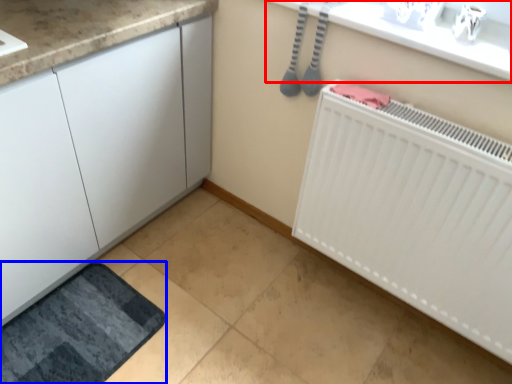
Question: Among these objects, which one is nearest to the camera, counter top (highlighted by a red box) or bath mat (highlighted by a blue box)?

Choices:
 (A) counter top
 (B) bath mat

Answer: (A)